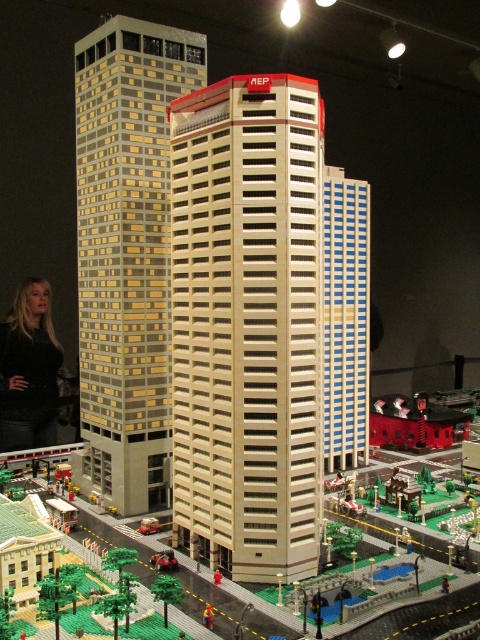
Is the position of beige brick building at center less distant than that of black sweater at lower left?

Yes, beige brick building at center is closer to the viewer.

Which is more to the right, beige brick building at center or black sweater at lower left?

beige brick building at center

Which is in front, point (265, 451) or point (24, 301)?

Point (265, 451) is in front.

The image size is (480, 640). Identify the location of beige brick building at center. (248, 324).

Between matte gold brick building at center and black sweater at lower left, which one has more height?

matte gold brick building at center is taller.

Between point (84, 490) and point (36, 355), which one is positioned behind?

Point (36, 355)

At what (x,y) coordinates should I click in order to perform the action: click on matte gold brick building at center. Please return your answer as a coordinate pair (x, y). Image resolution: width=480 pixels, height=640 pixels. Looking at the image, I should click on (127, 253).

Which is behind, point (354, 442) or point (44, 428)?

Point (44, 428)

Consider the image. Is blue/white striped building at center closer to camera compared to black sweater at lower left?

Yes, it is.

Locate an element on the screen. blue/white striped building at center is located at coordinates (346, 320).